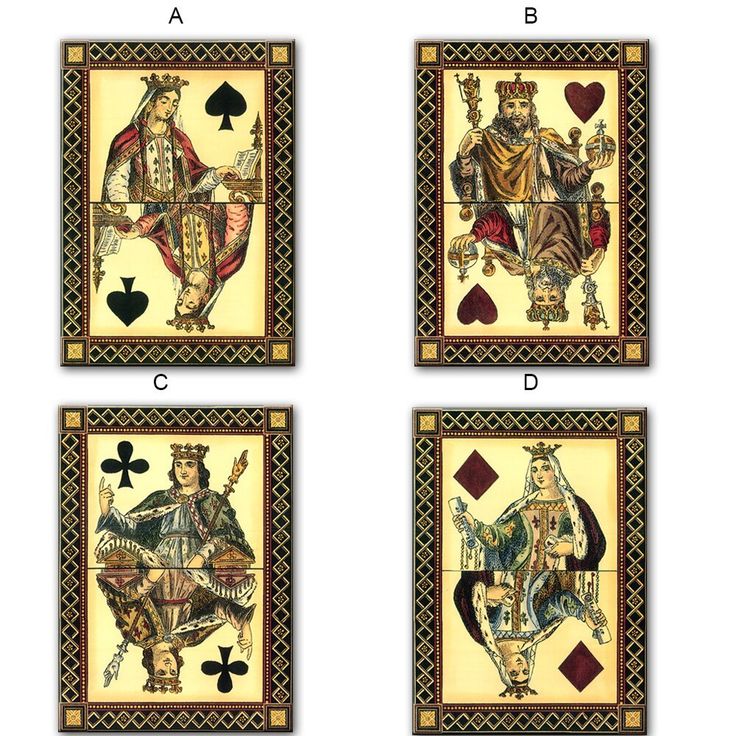
Image resolution: width=736 pixels, height=736 pixels. I want to click on playing cards, so click(197, 233), click(517, 226), click(539, 569), click(190, 536).